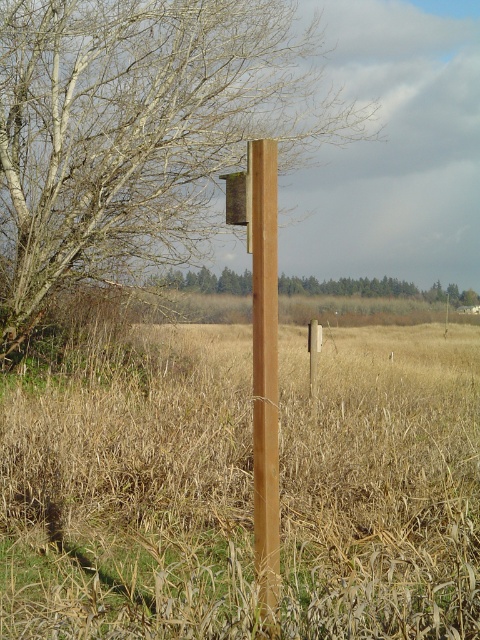
Question: Which point is closer to the camera?

Choices:
 (A) (264, 531)
 (B) (32, 413)
 (C) (288, 282)

Answer: (A)

Question: Can you confirm if dry grass at center is bigger than green matte tree at center?

Choices:
 (A) no
 (B) yes

Answer: (B)

Question: Which of these objects is positioned farthest from the dry grass at center?

Choices:
 (A) green matte tree at center
 (B) brown wood post at center

Answer: (A)

Question: Can you confirm if dry grass at center is positioned below green matte tree at center?

Choices:
 (A) no
 (B) yes

Answer: (B)

Question: Is brown wood post at center to the right of green matte tree at center from the viewer's perspective?

Choices:
 (A) yes
 (B) no

Answer: (B)

Question: Among these points, which one is farthest from the camera?

Choices:
 (A) (464, 292)
 (B) (103, 19)
 (C) (263, 477)

Answer: (A)